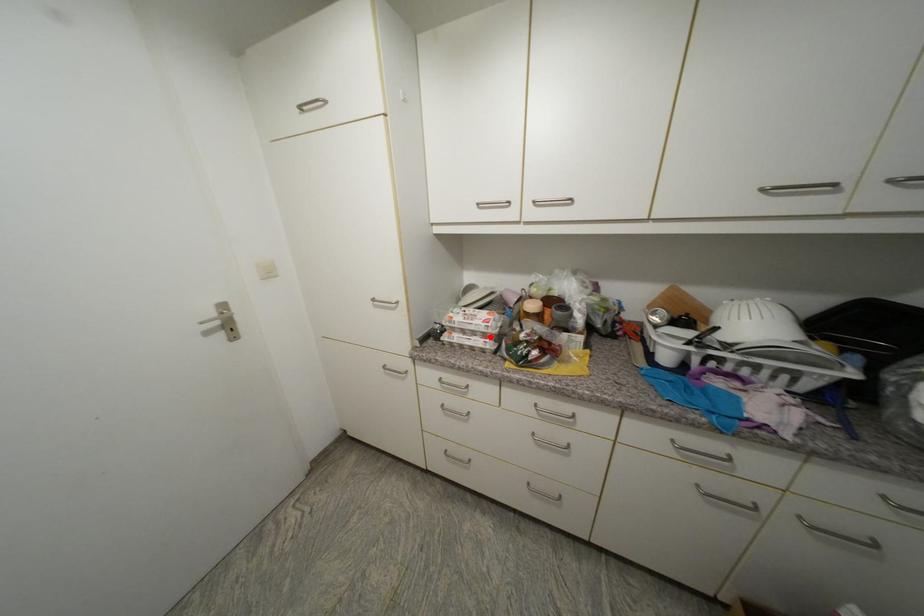
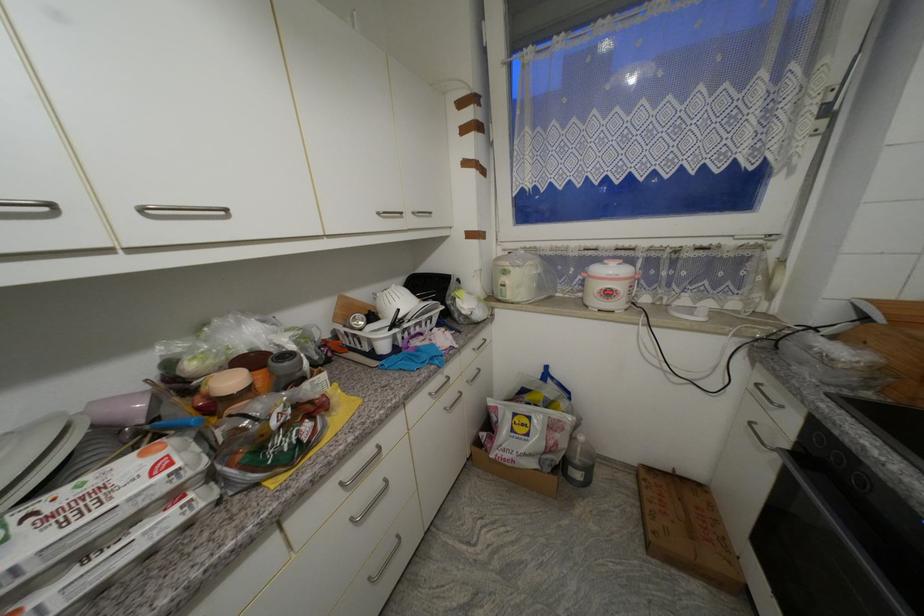
In the second image, find the point that corresponds to the highlighted location in the first image.

(178, 498)